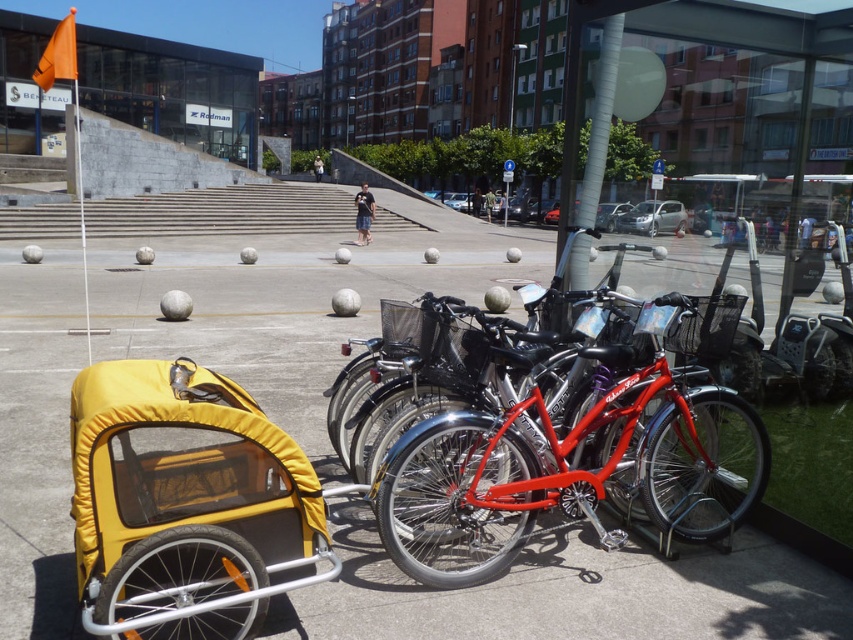
Does gray concrete pavement at center have a greater width compared to shiny metallic bicycle at center?

Indeed, gray concrete pavement at center has a greater width compared to shiny metallic bicycle at center.

Which is behind, point (538, 566) or point (677, 458)?

The point (677, 458) is behind.

Where is `gray concrete pavement at center`? gray concrete pavement at center is located at coordinates (575, 593).

Is gray concrete pavement at center to the right of yellow fabric baby carriage at lower left from the viewer's perspective?

In fact, gray concrete pavement at center is to the left of yellow fabric baby carriage at lower left.

Is gray concrete pavement at center shorter than yellow fabric baby carriage at lower left?

No.

The width and height of the screenshot is (853, 640). What are the coordinates of `gray concrete pavement at center` in the screenshot? It's located at (575, 593).

Between yellow fabric baby carriage at lower left and shiny metallic bicycle at center, which one has more height?

Standing taller between the two is shiny metallic bicycle at center.

Is point (236, 620) closer to camera compared to point (527, 515)?

Yes, point (236, 620) is closer to viewer.

Does point (131, 525) lie in front of point (517, 365)?

Yes, it is in front of point (517, 365).

The height and width of the screenshot is (640, 853). In order to click on yellow fabric baby carriage at lower left in this screenshot , I will do `click(184, 502)`.